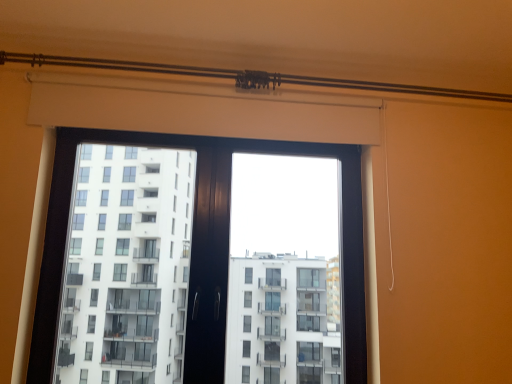
What is the approximate width of transparent glass window at center?

5.54 inches.

This screenshot has width=512, height=384. Describe the element at coordinates (203, 247) in the screenshot. I see `transparent glass window at center` at that location.

Identify the location of transparent glass window at center. (203, 247).

The image size is (512, 384). I want to click on transparent glass window at center, so pyautogui.click(x=203, y=247).